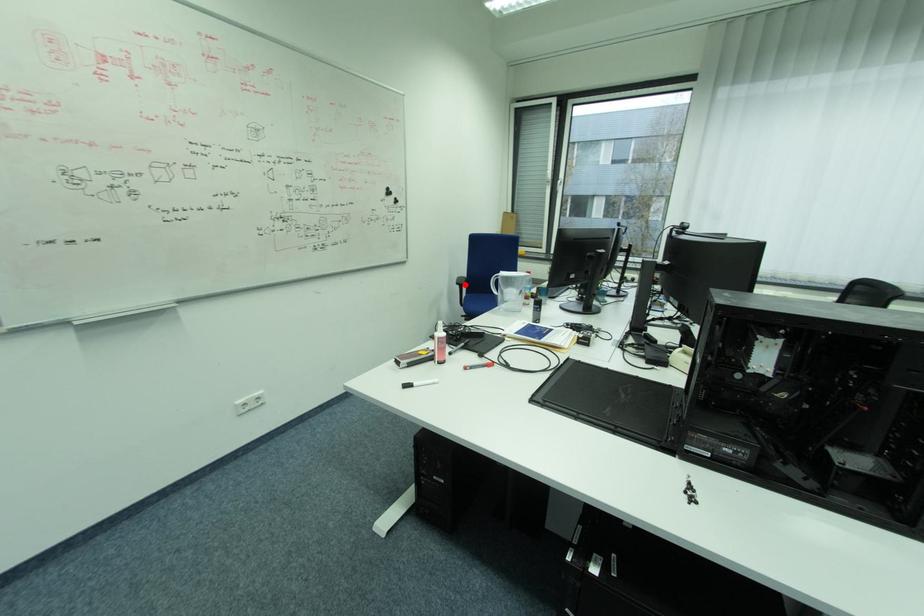
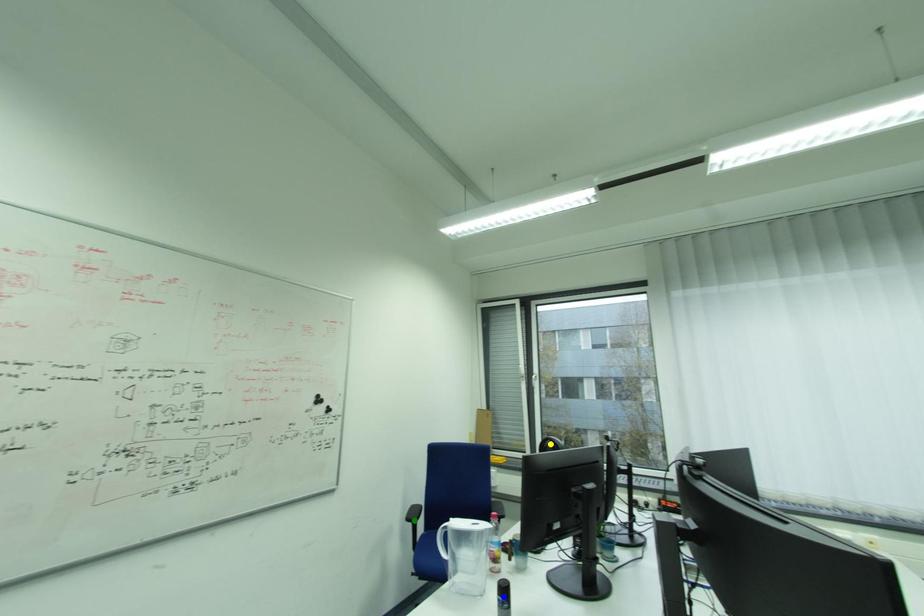
Question: I am providing you with two images of the same scene from different viewpoints. A red point is marked on the first image. You are given multiple points on the second image. Which point in image 2 is actually the same real-world point as the red point in image 1?

Choices:
 (A) green point
 (B) blue point
 (C) yellow point

Answer: (A)